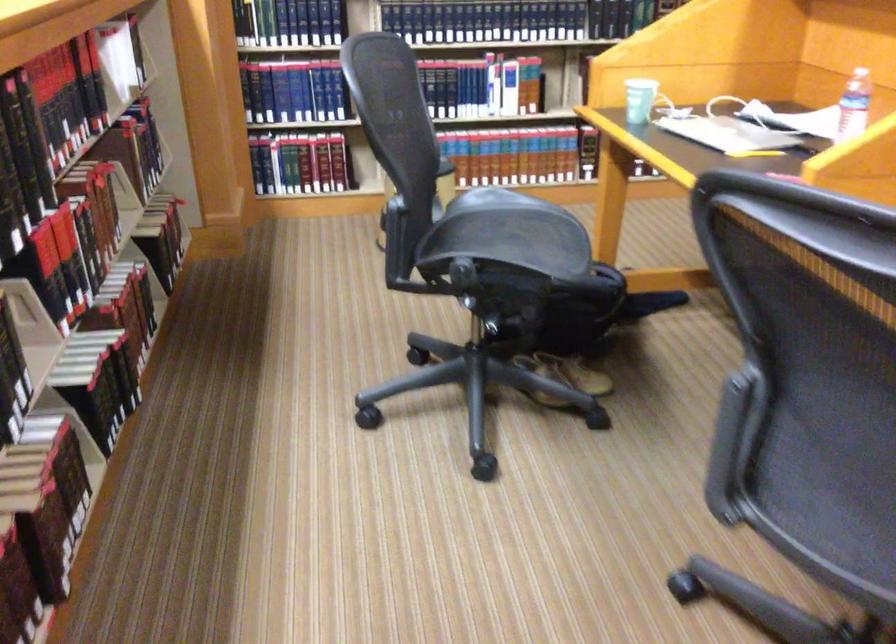
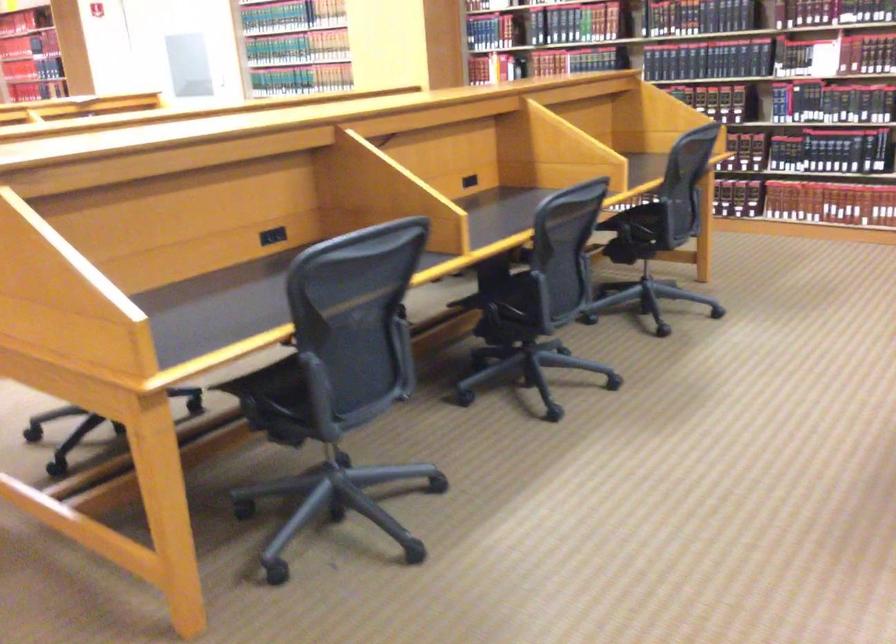
Question: I am providing you with two images of the same scene from different viewpoints. Please identify which objects are invisible in image2.

Choices:
 (A) chair sitting surface
 (B) chair armrest
 (C) hardcover book
 (D) green kiwi pouch

Answer: (A)